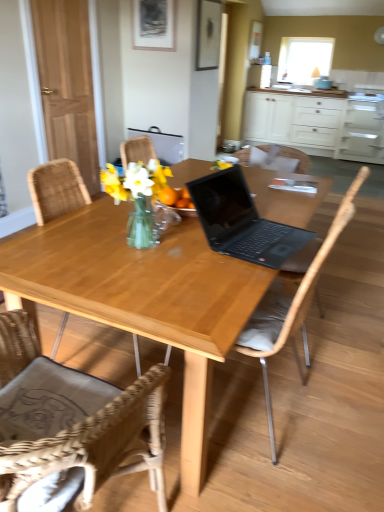
Find the location of a particular element. blank space situated above matte white armchair at upper center (from a real-world perspective) is located at coordinates (162, 121).